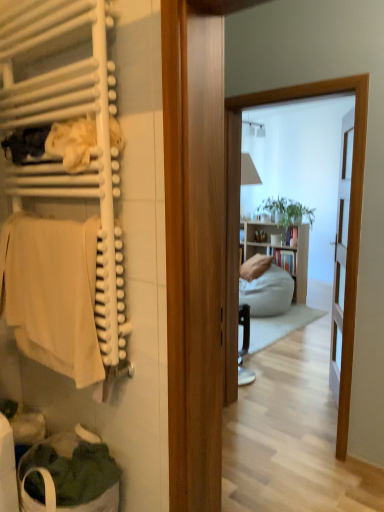
Question: Are white matte towel rack at left and white fabric laundry basket at lower left beside each other?

Choices:
 (A) no
 (B) yes

Answer: (A)

Question: Is white matte towel rack at left to the left of white fabric laundry basket at lower left from the viewer's perspective?

Choices:
 (A) no
 (B) yes

Answer: (B)

Question: From the image's perspective, is white matte towel rack at left on white fabric laundry basket at lower left?

Choices:
 (A) no
 (B) yes

Answer: (B)

Question: From a real-world perspective, is white matte towel rack at left positioned over white fabric laundry basket at lower left based on gravity?

Choices:
 (A) yes
 (B) no

Answer: (A)

Question: Is white fabric laundry basket at lower left completely or partially inside white matte towel rack at left?

Choices:
 (A) no
 (B) yes

Answer: (A)

Question: Do you think beige cotton towel at left is within white matte towel rack at left, or outside of it?

Choices:
 (A) inside
 (B) outside

Answer: (B)

Question: Considering their positions, is beige cotton towel at left located in front of or behind white matte towel rack at left?

Choices:
 (A) behind
 (B) front

Answer: (A)

Question: Is beige cotton towel at left wider or thinner than white matte towel rack at left?

Choices:
 (A) thin
 (B) wide

Answer: (A)

Question: From the image's perspective, is beige cotton towel at left above or below white matte towel rack at left?

Choices:
 (A) above
 (B) below

Answer: (B)

Question: Would you say white fabric laundry basket at lower left is to the left or to the right of beige cotton towel at left in the picture?

Choices:
 (A) left
 (B) right

Answer: (B)

Question: From a real-world perspective, is white fabric laundry basket at lower left positioned above or below beige cotton towel at left?

Choices:
 (A) above
 (B) below

Answer: (B)

Question: Is white fabric laundry basket at lower left bigger or smaller than beige cotton towel at left?

Choices:
 (A) big
 (B) small

Answer: (A)

Question: Is white fabric laundry basket at lower left in front of or behind beige cotton towel at left in the image?

Choices:
 (A) front
 (B) behind

Answer: (B)

Question: Based on their positions, is white matte towel rack at left located to the left or right of white fabric laundry basket at lower left?

Choices:
 (A) left
 (B) right

Answer: (A)

Question: Is white matte towel rack at left spatially inside white fabric laundry basket at lower left, or outside of it?

Choices:
 (A) outside
 (B) inside

Answer: (A)